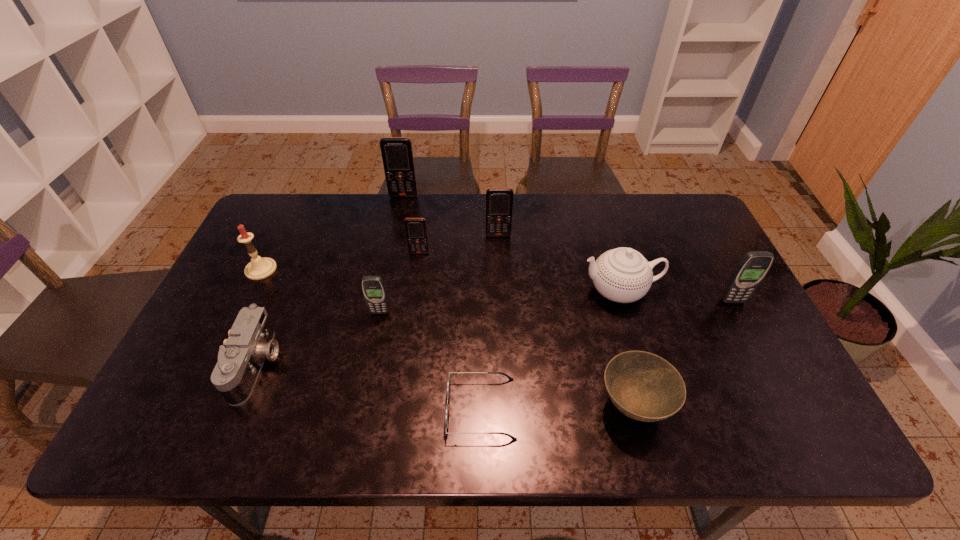
Identify which cellular telephone is the second nearest to the bigger gray cellular telephone. Please provide its 2D coordinates. Your answer should be formatted as a tuple, i.e. [(x, y)], where the tuple contains the x and y coordinates of a point satisfying the conditions above.

[(416, 232)]

Choose which cellular telephone is the second nearest neighbor to the bowl. Please provide its 2D coordinates. Your answer should be formatted as a tuple, i.e. [(x, y)], where the tuple contains the x and y coordinates of a point satisfying the conditions above.

[(499, 201)]

The width and height of the screenshot is (960, 540). Find the location of `the third closest orange cellular telephone to the candle`. the third closest orange cellular telephone to the candle is located at coordinates click(499, 201).

Identify which orange cellular telephone is the third closest to the bigger gray cellular telephone. Please provide its 2D coordinates. Your answer should be formatted as a tuple, i.e. [(x, y)], where the tuple contains the x and y coordinates of a point satisfying the conditions above.

[(397, 155)]

Find the location of `free space that satisfies the following two spatial constraints: 1. on the screen of the second cellular telephone from right to left; 2. on the lens of the ninth object from right to left`. free space that satisfies the following two spatial constraints: 1. on the screen of the second cellular telephone from right to left; 2. on the lens of the ninth object from right to left is located at coordinates (504, 364).

Find the location of a particular element. Image resolution: width=960 pixels, height=540 pixels. free point that satisfies the following two spatial constraints: 1. on the screen of the rightmost object; 2. on the lens of the ninth object from right to left is located at coordinates (766, 364).

Image resolution: width=960 pixels, height=540 pixels. Find the location of `vacant space that satisfies the following two spatial constraints: 1. on the screen of the bowl; 2. on the right side of the left gray cellular telephone`. vacant space that satisfies the following two spatial constraints: 1. on the screen of the bowl; 2. on the right side of the left gray cellular telephone is located at coordinates (361, 406).

This screenshot has height=540, width=960. Identify the location of free space that satisfies the following two spatial constraints: 1. on the spout of the chinaware; 2. on the screen of the nearer gray cellular telephone. (626, 312).